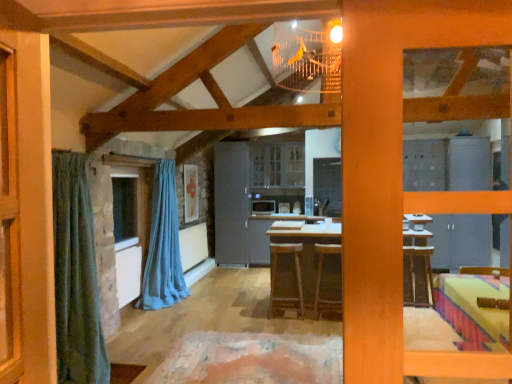
Question: From the image's perspective, is clear glass window at center above or below satin silver microwave at center?

Choices:
 (A) above
 (B) below

Answer: (A)

Question: Considering their positions, is clear glass window at center located in front of or behind satin silver microwave at center?

Choices:
 (A) front
 (B) behind

Answer: (A)

Question: Estimate the real-world distances between objects in this image. Which object is farther from the brown wooden stool at center, which ranks as the 2th stool in right-to-left order?

Choices:
 (A) wooden table at center
 (B) clear glass window at center
 (C) gray matte refrigerator at center
 (D) blue fabric curtain at left
 (E) satin silver microwave at center

Answer: (E)

Question: Which of these objects is positioned farthest from the brown wooden stool at center, which ranks as the 2th stool in right-to-left order?

Choices:
 (A) gray matte refrigerator at center
 (B) satin silver microwave at center
 (C) clear glass window at center
 (D) blue fabric curtain at left
 (E) brown wooden stool at center, which is counted as the 1th stool, starting from the right

Answer: (B)